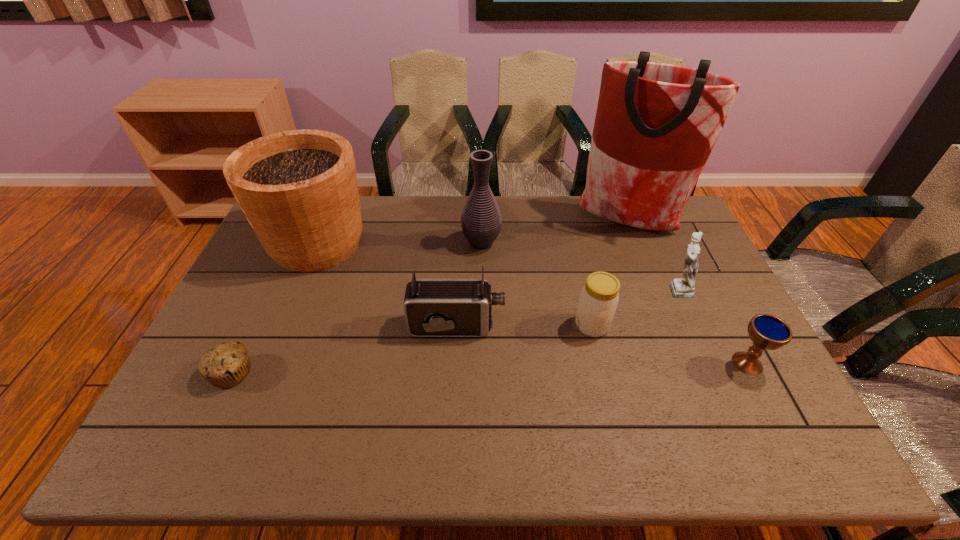
At what (x,y) coordinates should I click in order to perform the action: click on vacant area at the left edge. Please return your answer as a coordinate pair (x, y). This screenshot has width=960, height=540. Looking at the image, I should click on (271, 316).

The width and height of the screenshot is (960, 540). Find the location of `free location at the right edge`. free location at the right edge is located at coordinates click(x=782, y=417).

In the image, there is a desktop. Where is `free space at the near left corner`? The height and width of the screenshot is (540, 960). free space at the near left corner is located at coordinates (178, 451).

At what (x,y) coordinates should I click in order to perform the action: click on free spot between the vase and the flowerpot. Please return your answer as a coordinate pair (x, y). Looking at the image, I should click on (399, 243).

Locate an element on the screen. Image resolution: width=960 pixels, height=540 pixels. free space between the vase and the grocery bag is located at coordinates (554, 233).

Image resolution: width=960 pixels, height=540 pixels. In order to click on unoccupied area between the grocery bag and the vase in this screenshot , I will do `click(554, 233)`.

At what (x,y) coordinates should I click in order to perform the action: click on free space that is in between the chalice and the flowerpot. Please return your answer as a coordinate pair (x, y). Image resolution: width=960 pixels, height=540 pixels. Looking at the image, I should click on (532, 303).

This screenshot has width=960, height=540. I want to click on vacant space that's between the flowerpot and the figurine, so click(x=497, y=266).

Identify the location of vacant area that lies between the jar and the vase. Image resolution: width=960 pixels, height=540 pixels. (537, 284).

Where is `vacant space that's between the jar and the muffin`? The width and height of the screenshot is (960, 540). vacant space that's between the jar and the muffin is located at coordinates (412, 349).